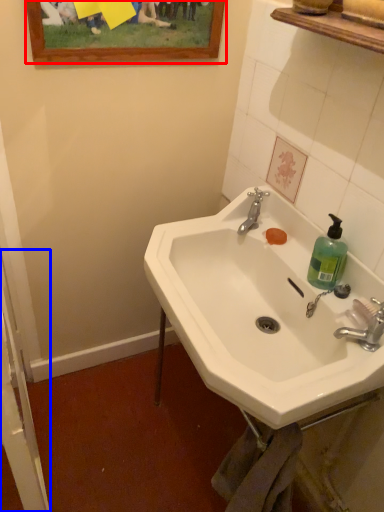
Question: Among these objects, which one is nearest to the camera, picture frame (highlighted by a red box) or screen door (highlighted by a blue box)?

Choices:
 (A) picture frame
 (B) screen door

Answer: (B)